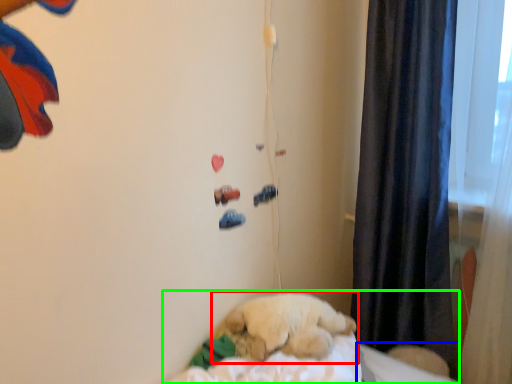
Question: Which is nearer to the dog (highlighted by a red box)? sheet (highlighted by a blue box) or bed (highlighted by a green box).

Choices:
 (A) sheet
 (B) bed

Answer: (B)